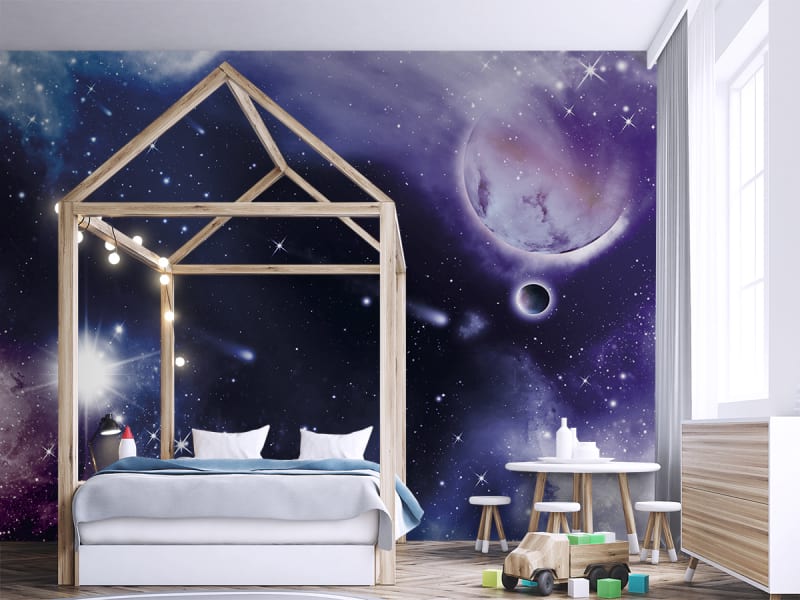
Locate an element on the screen. Image resolution: width=800 pixels, height=600 pixels. leg areas of stools is located at coordinates (657, 535), (557, 525), (490, 518).